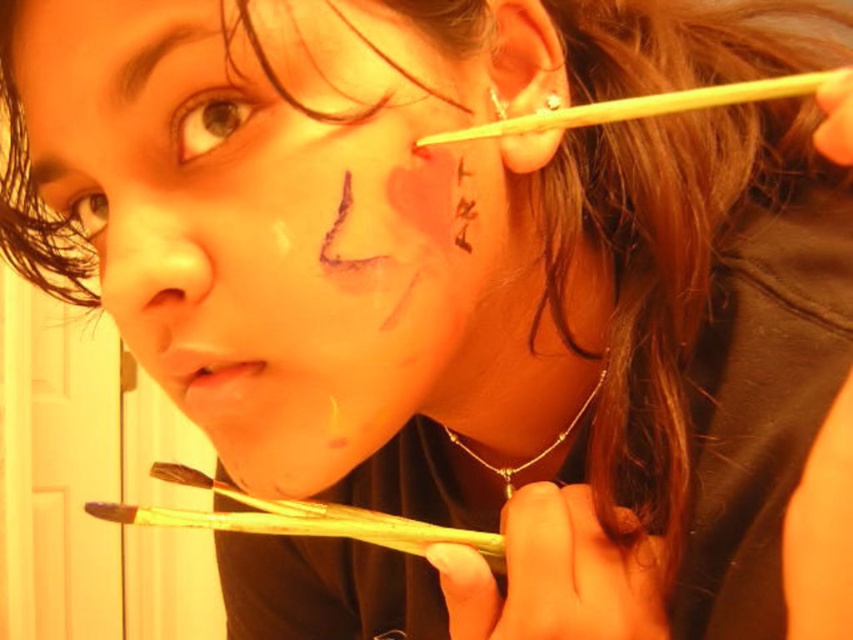
Question: In this image, where is matte black paint at center located relative to dark brown hair at upper left?

Choices:
 (A) right
 (B) left

Answer: (A)

Question: Does yellow wood chopstick at ear appear on the left side of dark brown hair at upper left?

Choices:
 (A) no
 (B) yes

Answer: (A)

Question: Which point is farther to the camera?

Choices:
 (A) matte black paint at center
 (B) brown matte eyebrow at upper left
 (C) matte flesh-colored nose at center

Answer: (B)

Question: Which object appears farthest from the camera in this image?

Choices:
 (A) yellow wood chopstick at ear
 (B) brown matte eyebrow at upper left

Answer: (B)

Question: Which of the following is the farthest from the observer?

Choices:
 (A) (53, 172)
 (B) (189, 163)

Answer: (A)

Question: Is matte black paint at center thinner than brown matte eyebrow at upper left?

Choices:
 (A) yes
 (B) no

Answer: (B)